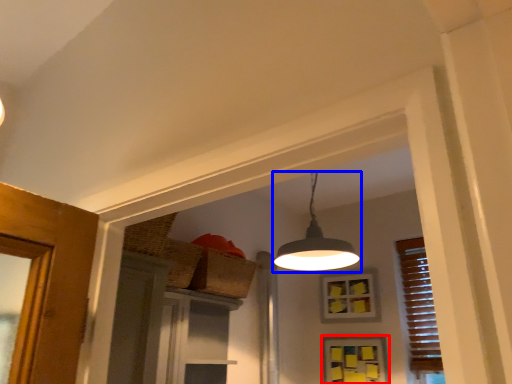
Question: Which object is further to the camera taking this photo, window (highlighted by a red box) or lamp (highlighted by a blue box)?

Choices:
 (A) window
 (B) lamp

Answer: (A)